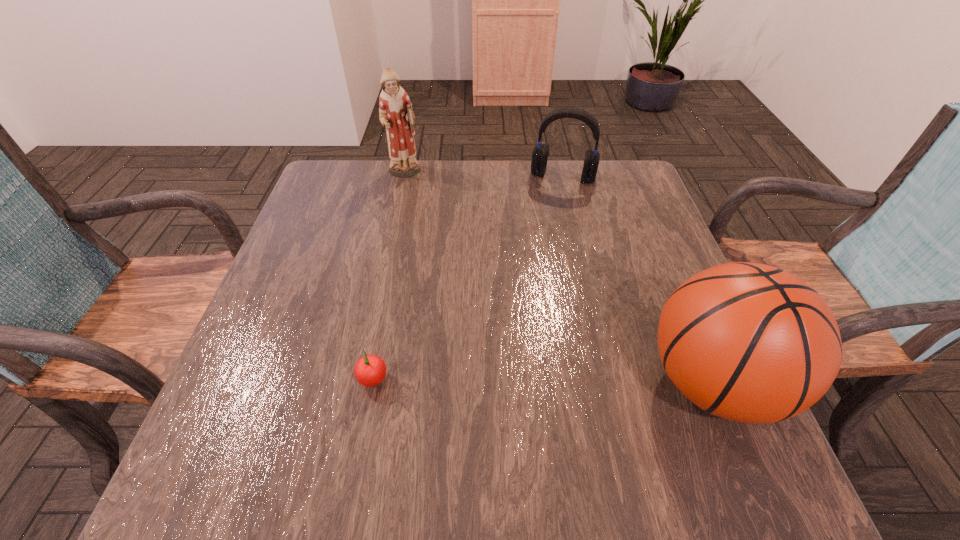
Where is `the shortest object`? the shortest object is located at coordinates (370, 370).

I want to click on basketball, so click(x=748, y=342).

Find the location of `the third tallest object`. the third tallest object is located at coordinates (540, 153).

Find the location of a particular element. figurine is located at coordinates (395, 109).

This screenshot has height=540, width=960. Find the location of `free spot located on the back of the cherry`. free spot located on the back of the cherry is located at coordinates [x=398, y=246].

In order to click on free space located 0.240m on the back of the basketball in this screenshot , I will do `click(657, 248)`.

The height and width of the screenshot is (540, 960). In order to click on vacant area situated on the headband of the headset in this screenshot , I will do `click(544, 235)`.

Where is `vacant space situated 0.210m on the headband of the headset`? vacant space situated 0.210m on the headband of the headset is located at coordinates (544, 235).

Where is `vacant space located 0.270m on the headband of the headset`? This screenshot has width=960, height=540. vacant space located 0.270m on the headband of the headset is located at coordinates (540, 251).

Identify the location of free space located 0.170m on the front-facing side of the figurine. click(x=426, y=215).